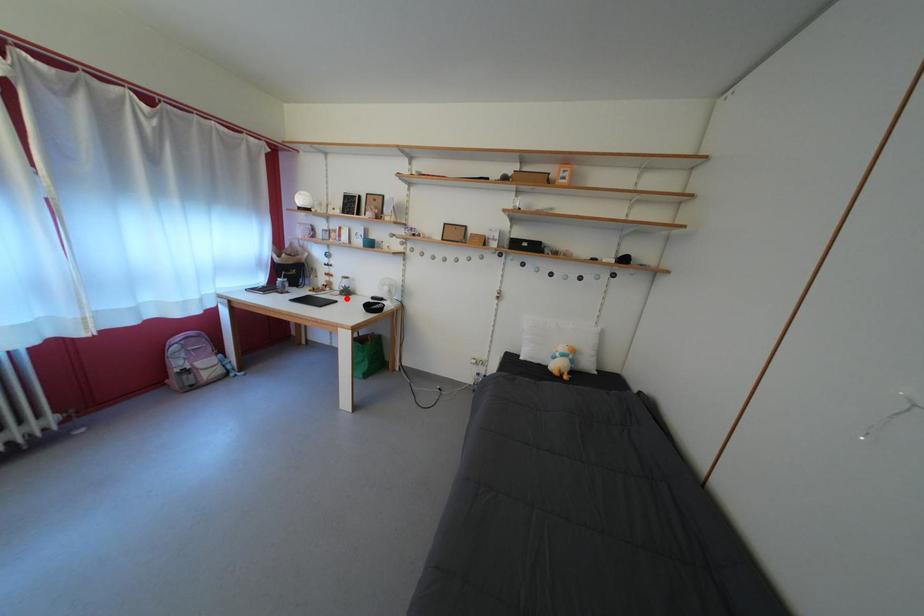
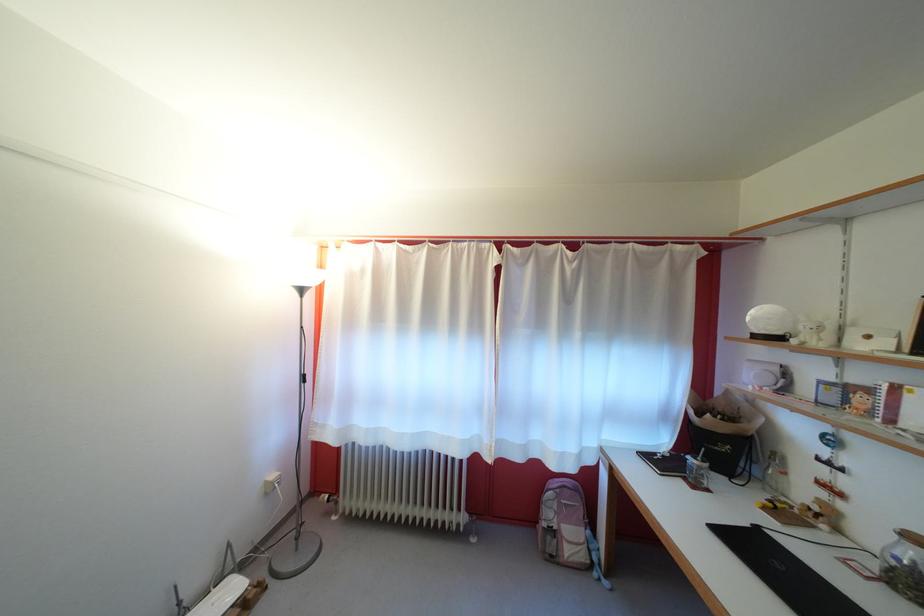
In the second image, find the point that corresponds to the highlighted location in the first image.

(881, 570)